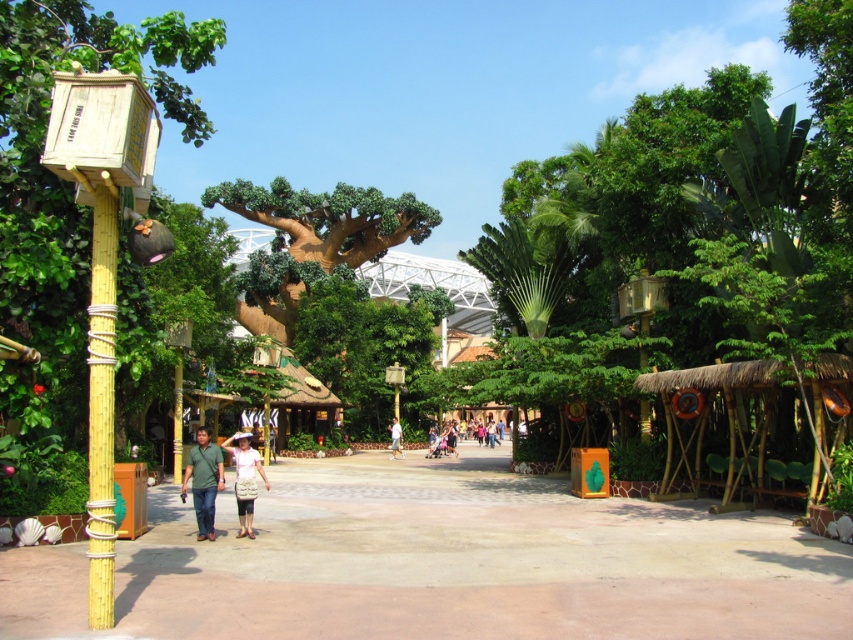
Is brown textured tree at center smaller than white fabric shirt at center?

No.

Between brown textured tree at center and white fabric shirt at center, which one has more height?

brown textured tree at center is taller.

Which is behind, point (300, 189) or point (399, 442)?

The point (300, 189) is more distant.

The image size is (853, 640). Identify the location of brown textured tree at center. (312, 241).

In the scene shown: Which is below, brown concrete path at center or green fabric shirt at lower left?

brown concrete path at center is lower down.

Between brown concrete path at center and green fabric shirt at lower left, which one appears on the right side from the viewer's perspective?

Positioned to the right is brown concrete path at center.

Does point (730, 531) lie in front of point (200, 461)?

No, it is behind (200, 461).

This screenshot has height=640, width=853. I want to click on brown concrete path at center, so click(x=442, y=563).

Can you confirm if green fabric shirt at lower left is wider than white fabric shirt at center?

Indeed, green fabric shirt at lower left has a greater width compared to white fabric shirt at center.

Can you confirm if green fabric shirt at lower left is positioned to the left of white fabric shirt at center?

Indeed, green fabric shirt at lower left is positioned on the left side of white fabric shirt at center.

Does point (222, 465) come closer to viewer compared to point (395, 422)?

That is True.

Identify the location of green fabric shirt at lower left. (202, 481).